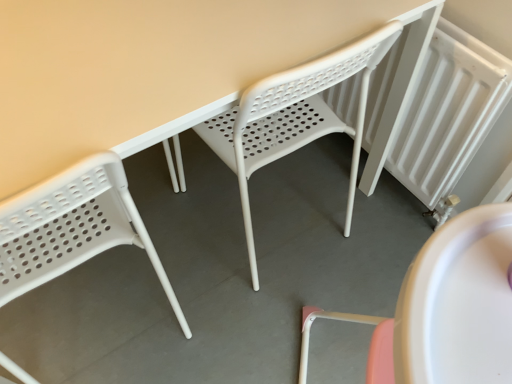
Question: Which direction should I rotate to face white plastic chair at center, which is counted as the second chair, starting from the left, — up or down?

Choices:
 (A) down
 (B) up

Answer: (B)

Question: From the image's perspective, does white textured radiator at right appear lower than white plastic chair at center, which appears as the 1th chair when viewed from the right?

Choices:
 (A) yes
 (B) no

Answer: (B)

Question: Is white textured radiator at right at the right side of white plastic chair at center, which appears as the 1th chair when viewed from the right?

Choices:
 (A) no
 (B) yes

Answer: (B)

Question: Does white textured radiator at right lie behind white plastic chair at center, which appears as the 1th chair when viewed from the right?

Choices:
 (A) yes
 (B) no

Answer: (A)

Question: Is white textured radiator at right in contact with white plastic chair at center, which appears as the 1th chair when viewed from the right?

Choices:
 (A) no
 (B) yes

Answer: (A)

Question: From a real-world perspective, is white textured radiator at right located beneath white plastic chair at center, which appears as the 1th chair when viewed from the right?

Choices:
 (A) yes
 (B) no

Answer: (A)

Question: Is the position of white textured radiator at right less distant than that of white plastic chair at center, which is counted as the second chair, starting from the left?

Choices:
 (A) yes
 (B) no

Answer: (B)

Question: Does white plastic chair at left, arranged as the 1th chair when viewed from the left, lie behind white plastic chair at center, which appears as the 1th chair when viewed from the right?

Choices:
 (A) no
 (B) yes

Answer: (A)

Question: Is white plastic chair at left, arranged as the 1th chair when viewed from the left, turned away from white plastic chair at center, which appears as the 1th chair when viewed from the right?

Choices:
 (A) yes
 (B) no

Answer: (B)

Question: Considering the relative sizes of white plastic chair at left, arranged as the 1th chair when viewed from the left, and white plastic chair at center, which is counted as the second chair, starting from the left, in the image provided, is white plastic chair at left, arranged as the 1th chair when viewed from the left, bigger than white plastic chair at center, which is counted as the second chair, starting from the left,?

Choices:
 (A) no
 (B) yes

Answer: (A)

Question: Does white plastic chair at left, which is counted as the 2th chair, starting from the right, have a smaller size compared to white plastic chair at center, which appears as the 1th chair when viewed from the right?

Choices:
 (A) no
 (B) yes

Answer: (B)

Question: Does white plastic chair at left, arranged as the 1th chair when viewed from the left, come in front of white plastic chair at center, which is counted as the second chair, starting from the left?

Choices:
 (A) yes
 (B) no

Answer: (A)

Question: From a real-world perspective, does white plastic chair at left, arranged as the 1th chair when viewed from the left, stand above white plastic chair at center, which appears as the 1th chair when viewed from the right?

Choices:
 (A) yes
 (B) no

Answer: (A)

Question: Does white plastic chair at center, which appears as the 1th chair when viewed from the right, come in front of white plastic chair at left, which is counted as the 2th chair, starting from the right?

Choices:
 (A) yes
 (B) no

Answer: (B)